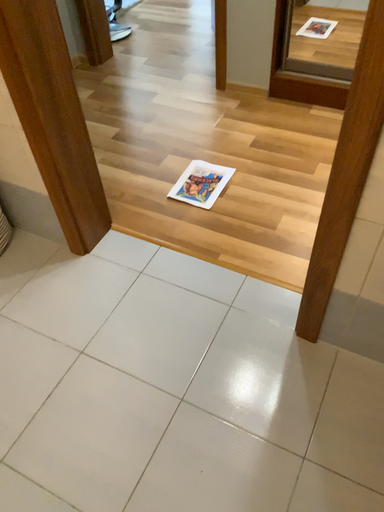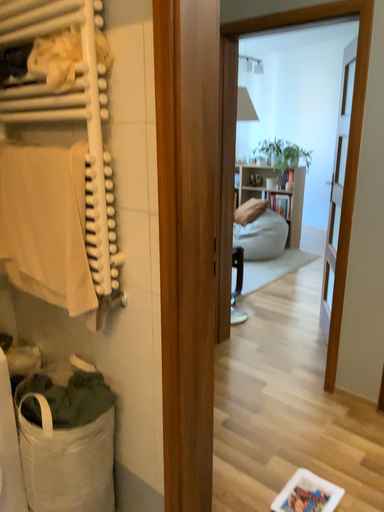
Question: How did the camera likely rotate when shooting the video?

Choices:
 (A) rotated upward
 (B) rotated downward

Answer: (A)